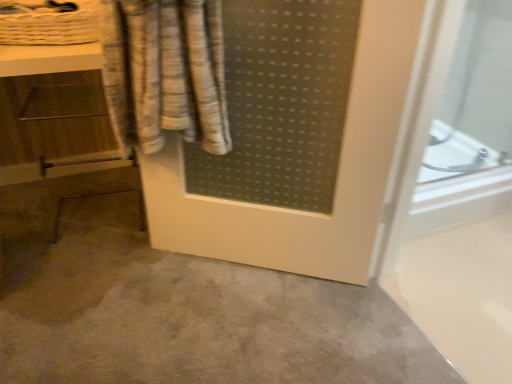
Where is `white woven basket at upper left`? white woven basket at upper left is located at coordinates (48, 22).

This screenshot has height=384, width=512. Describe the element at coordinates (190, 315) in the screenshot. I see `gray matte concrete at center` at that location.

Where is `white woven basket at upper left`? The width and height of the screenshot is (512, 384). white woven basket at upper left is located at coordinates (48, 22).

Is wooden vanity at left taller or shorter than gray matte concrete at center?

Clearly, wooden vanity at left is taller compared to gray matte concrete at center.

Considering the positions of objects wooden vanity at left and gray matte concrete at center in the image provided, who is more to the left, wooden vanity at left or gray matte concrete at center?

Positioned to the left is wooden vanity at left.

Is wooden vanity at left wider or thinner than gray matte concrete at center?

Clearly, wooden vanity at left has less width compared to gray matte concrete at center.

Is wooden vanity at left positioned beyond the bounds of gray matte concrete at center?

Yes, wooden vanity at left is located beyond the bounds of gray matte concrete at center.

Which of these two, white woven basket at upper left or wooden vanity at left, stands shorter?

Standing shorter between the two is white woven basket at upper left.

Which point is more forward, (70,41) or (112,182)?

Point (70,41)

What's the angular difference between white woven basket at upper left and wooden vanity at left's facing directions?

The angular difference between white woven basket at upper left and wooden vanity at left is 0.000655 degrees.

Which is in front, point (46, 17) or point (74, 246)?

The point (46, 17) is closer to the camera.

Locate an element on the screen. This screenshot has width=512, height=384. concrete directly beneath the white woven basket at upper left (from a real-world perspective) is located at coordinates (190, 315).

From a real-world perspective, is white woven basket at upper left physically below gray matte concrete at center?

No, from a real-world perspective, white woven basket at upper left is not beneath gray matte concrete at center.

Is white woven basket at upper left with gray matte concrete at center?

white woven basket at upper left is not next to gray matte concrete at center, and they're not touching.

Considering the positions of points (199, 343) and (19, 88), is point (199, 343) closer to camera compared to point (19, 88)?

Yes.

Consider the image. Who is shorter, gray matte concrete at center or wooden vanity at left?

gray matte concrete at center is shorter.

From the image's perspective, would you say gray matte concrete at center is shown under wooden vanity at left?

Yes.

Can you see gray matte concrete at center touching wooden vanity at left?

No, gray matte concrete at center is not with wooden vanity at left.

Can you tell me how much wooden vanity at left and white woven basket at upper left differ in facing direction?

The angular difference between wooden vanity at left and white woven basket at upper left is 0.000655 degrees.

From the picture: Who is smaller, wooden vanity at left or white woven basket at upper left?

white woven basket at upper left is smaller.

Is wooden vanity at left with white woven basket at upper left?

No, wooden vanity at left is not touching white woven basket at upper left.

Locate an element on the screen. This screenshot has width=512, height=384. vanity below the white woven basket at upper left (from the image's perspective) is located at coordinates (59, 130).

From the picture: Between gray matte concrete at center and white woven basket at upper left, which one has more height?

white woven basket at upper left is taller.

From a real-world perspective, which is physically above, gray matte concrete at center or white woven basket at upper left?

In real-world perspective, white woven basket at upper left is above.

Can you tell me how much gray matte concrete at center and white woven basket at upper left differ in facing direction?

gray matte concrete at center and white woven basket at upper left are facing 1.3 degrees away from each other.

Locate an element on the screen. This screenshot has height=384, width=512. vanity located above the gray matte concrete at center (from a real-world perspective) is located at coordinates (59, 130).

Identify the location of basket behind the wooden vanity at left. The height and width of the screenshot is (384, 512). (48, 22).

Which object lies further to the anchor point white woven basket at upper left, gray matte concrete at center or wooden vanity at left?

Among the two, gray matte concrete at center is located further to white woven basket at upper left.

Looking at the image, which one is located closer to gray matte concrete at center, white woven basket at upper left or wooden vanity at left?

wooden vanity at left is closer to gray matte concrete at center.

When comparing their distances from gray matte concrete at center, does wooden vanity at left or white woven basket at upper left seem closer?

wooden vanity at left.

Based on their spatial positions, is wooden vanity at left or gray matte concrete at center further from white woven basket at upper left?

gray matte concrete at center lies further to white woven basket at upper left than the other object.

Based on their spatial positions, is gray matte concrete at center or white woven basket at upper left further from wooden vanity at left?

Based on the image, gray matte concrete at center appears to be further to wooden vanity at left.

Estimate the real-world distances between objects in this image. Which object is further from wooden vanity at left, white woven basket at upper left or gray matte concrete at center?

Among the two, gray matte concrete at center is located further to wooden vanity at left.

At what (x,y) coordinates should I click in order to perform the action: click on vanity between white woven basket at upper left and gray matte concrete at center from top to bottom. Please return your answer as a coordinate pair (x, y). This screenshot has height=384, width=512. Looking at the image, I should click on (59, 130).